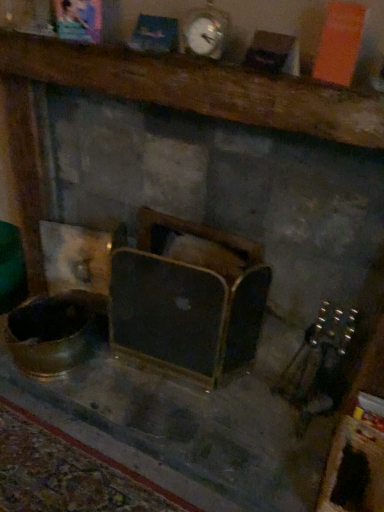
I want to click on vacant space underneath wooden framed mirror at center, placed as the first furniture when sorted from bottom to top (from a real-world perspective), so click(171, 369).